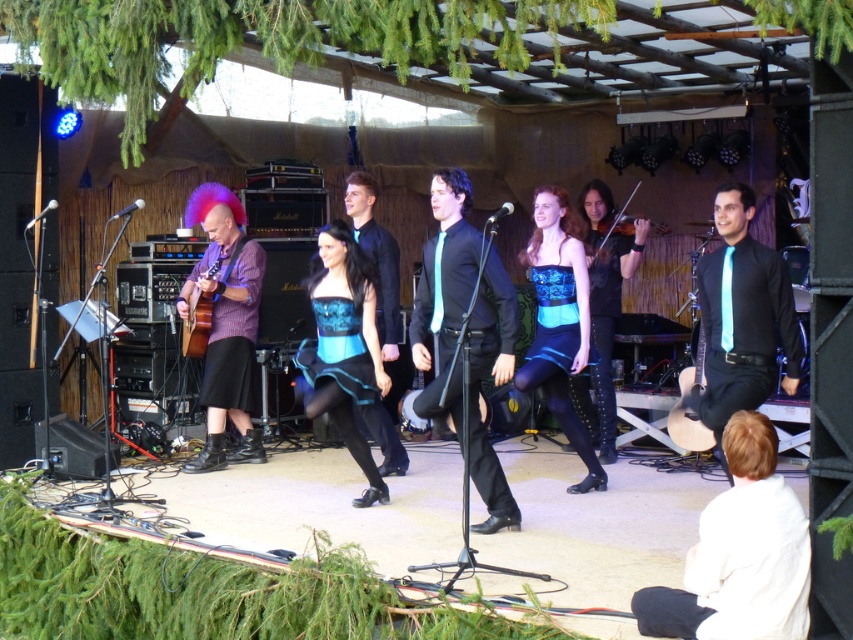
Is matte black suit at center below blue satin dress at center?

Indeed, matte black suit at center is positioned under blue satin dress at center.

Does point (479, 294) come behind point (532, 196)?

No, (479, 294) is closer to viewer.

Is point (500, 349) farther from viewer compared to point (573, 278)?

No, (500, 349) is in front of (573, 278).

Find the location of `matte black suit at center`. matte black suit at center is located at coordinates (444, 291).

Between point (315, 288) and point (381, 417), which one is positioned in front?

Point (315, 288)

Which is below, blue satin corset at center or black satin shirt at center?

blue satin corset at center is lower down.

Does point (335, 381) come in front of point (396, 310)?

That is True.

Locate an element on the screen. The height and width of the screenshot is (640, 853). blue satin corset at center is located at coordinates (344, 348).

Where is `matte black suit at center`? This screenshot has width=853, height=640. matte black suit at center is located at coordinates (444, 291).

Does point (416, 332) come in front of point (376, 486)?

Yes, it is in front of point (376, 486).

Locate an element on the screen. matte black suit at center is located at coordinates (444, 291).